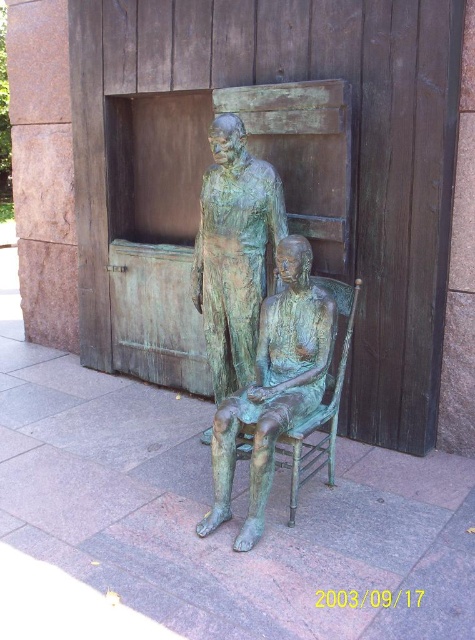
Question: Is green patina statue at center positioned behind green patina bronze statue at center?

Choices:
 (A) no
 (B) yes

Answer: (A)

Question: From the image, what is the correct spatial relationship of green patina statue at center in relation to green patina bronze statue at center?

Choices:
 (A) below
 (B) above

Answer: (A)

Question: Does green patina statue at center have a lesser width compared to green patina bronze statue at center?

Choices:
 (A) yes
 (B) no

Answer: (B)

Question: Among these points, which one is farthest from the camera?

Choices:
 (A) (298, 280)
 (B) (219, 236)

Answer: (B)